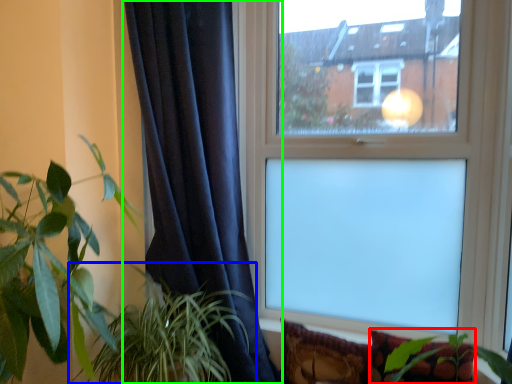
Question: Which object is positioned closest to pillow (highlighted by a red box)? Select from houseplant (highlighted by a blue box) and curtain (highlighted by a green box).

Choices:
 (A) houseplant
 (B) curtain

Answer: (A)